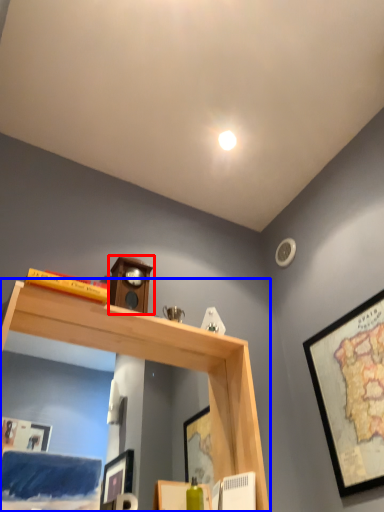
Question: Among these objects, which one is nearest to the camera, clock (highlighted by a red box) or shelf (highlighted by a blue box)?

Choices:
 (A) clock
 (B) shelf

Answer: (B)